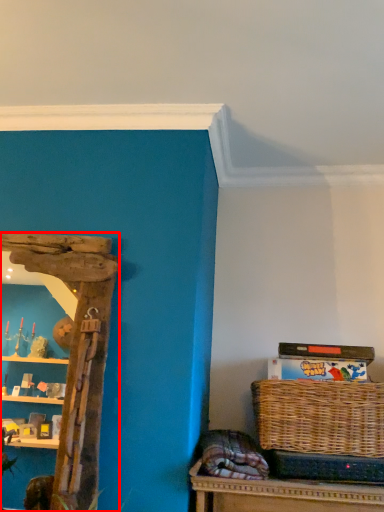
Question: From the image, what is the correct spatial relationship of shelf (annotated by the red box) in relation to picnic basket?

Choices:
 (A) left
 (B) right

Answer: (A)